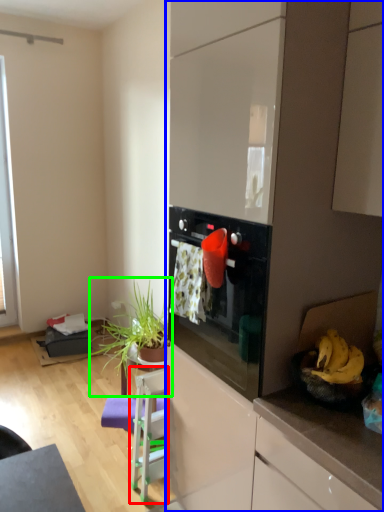
Question: Which object is the closest to the chair (highlighted by a red box)? Choose among these: dresser (highlighted by a blue box) or houseplant (highlighted by a green box).

Choices:
 (A) dresser
 (B) houseplant

Answer: (B)